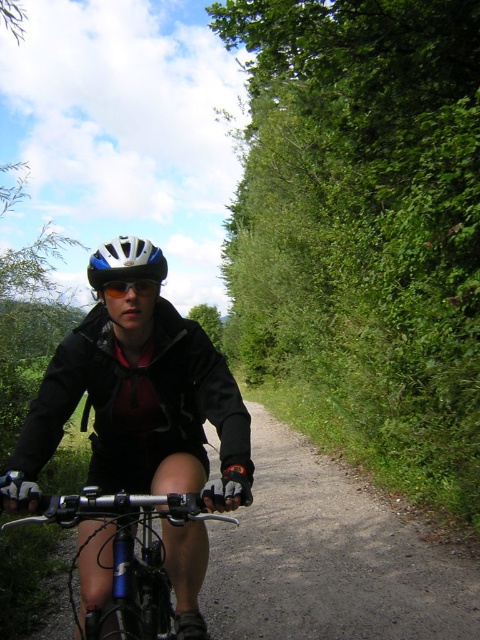
You are a cyclist observing your gear. You notice the blue metallic bicycle at center and the white matte bicycle helmet at center. Which object is positioned lower in the image?

The blue metallic bicycle at center is located below the white matte bicycle helmet at center, so the blue metallic bicycle at center is positioned lower in the image.